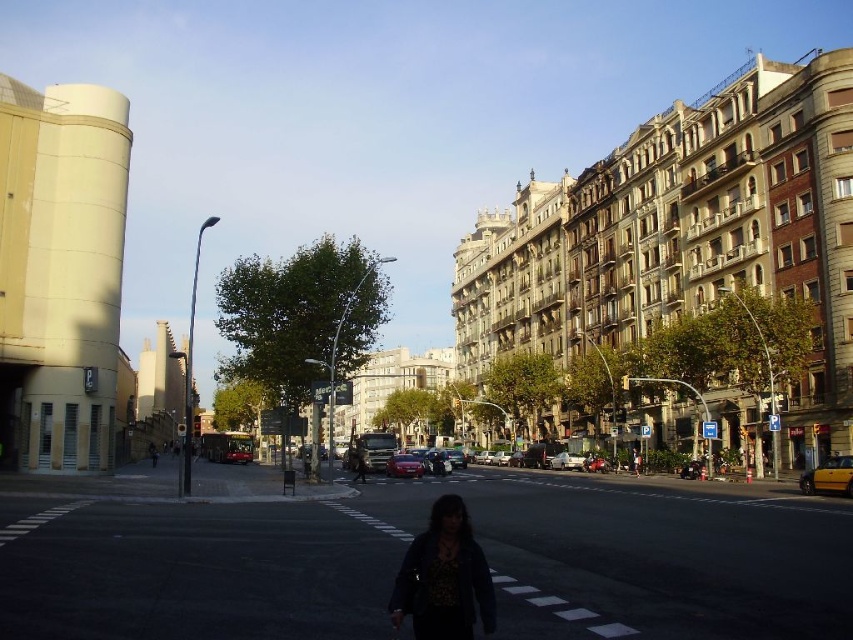
Question: Estimate the real-world distances between objects in this image. Which object is closer to the dark brown leather jacket at center?

Choices:
 (A) shiny red car at center
 (B) metallic red car at center

Answer: (B)

Question: Is yellow matte taxi at lower right to the left of metallic red car at center from the viewer's perspective?

Choices:
 (A) no
 (B) yes

Answer: (A)

Question: Which point is farther to the camera?

Choices:
 (A) (831, 458)
 (B) (404, 456)
 (C) (354, 472)

Answer: (C)

Question: Which object is positioned farthest from the dark brown leather jacket at center?

Choices:
 (A) shiny silver car at center
 (B) shiny red car at center

Answer: (A)

Question: Can you confirm if yellow matte taxi at lower right is thinner than shiny silver car at center?

Choices:
 (A) yes
 (B) no

Answer: (B)

Question: Is yellow matte taxi at lower right further to the viewer compared to metallic red car at center?

Choices:
 (A) yes
 (B) no

Answer: (B)